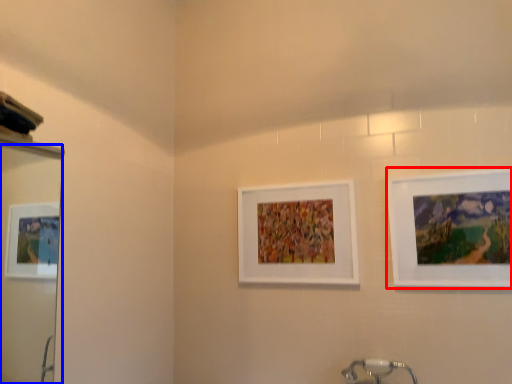
Question: Among these objects, which one is nearest to the camera, picture frame (highlighted by a red box) or mirror (highlighted by a blue box)?

Choices:
 (A) picture frame
 (B) mirror

Answer: (B)